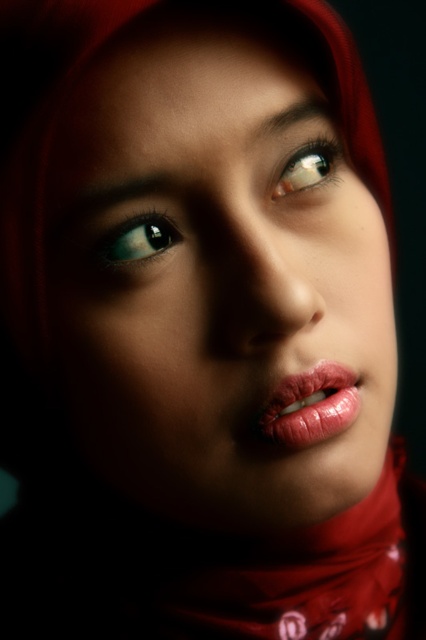
Question: Can you confirm if matte red hijab at center is positioned above shiny brown eye at upper center?

Choices:
 (A) no
 (B) yes

Answer: (A)

Question: Among these objects, which one is nearest to the camera?

Choices:
 (A) matte red hijab at center
 (B) shiny pink lips at center

Answer: (A)

Question: Which point is farther to the camera?

Choices:
 (A) (322, 426)
 (B) (138, 257)

Answer: (A)

Question: Which of the following is the closest to the observer?

Choices:
 (A) shiny brown eye at upper center
 (B) matte blue eye at upper left
 (C) matte red hijab at center
 (D) shiny pink lips at center

Answer: (C)

Question: Observing the image, what is the correct spatial positioning of shiny pink lips at center in reference to shiny brown eye at upper center?

Choices:
 (A) right
 (B) left

Answer: (B)

Question: Can you confirm if shiny pink lips at center is thinner than shiny brown eye at upper center?

Choices:
 (A) no
 (B) yes

Answer: (A)